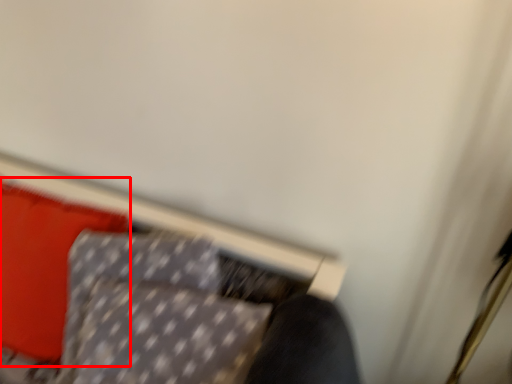
Question: From the image's perspective, what is the correct spatial relationship of pillow (annotated by the red box) in relation to furniture?

Choices:
 (A) above
 (B) below

Answer: (A)